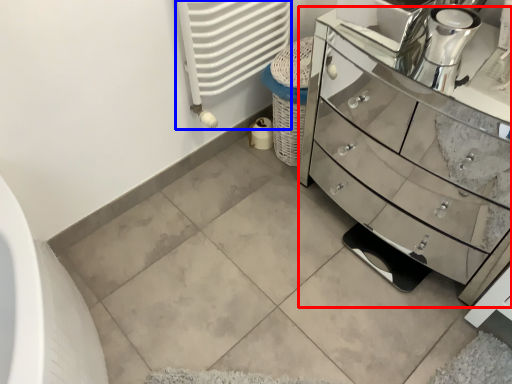
Question: Which object appears farthest to the camera in this image, chest of drawers (highlighted by a red box) or radiator (highlighted by a blue box)?

Choices:
 (A) chest of drawers
 (B) radiator

Answer: (B)